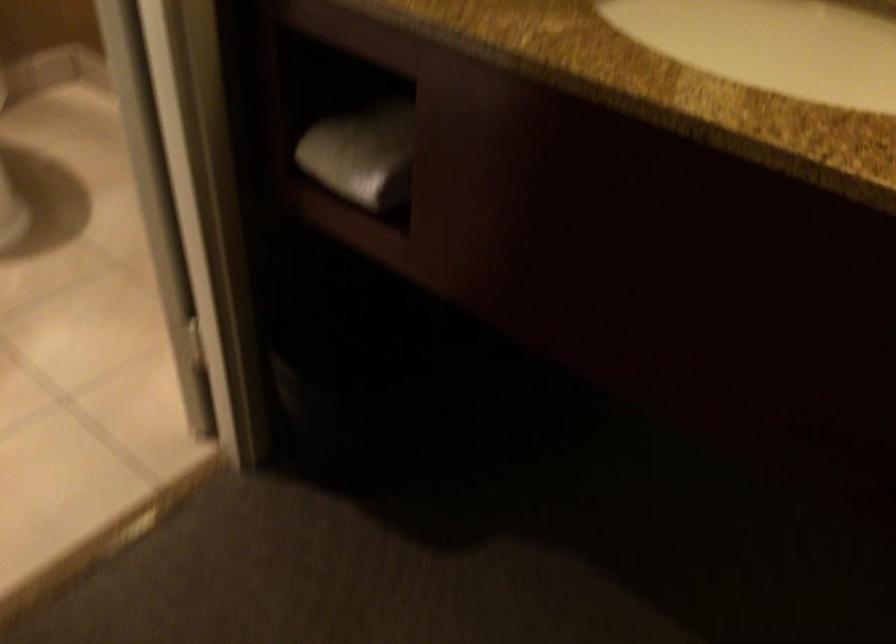
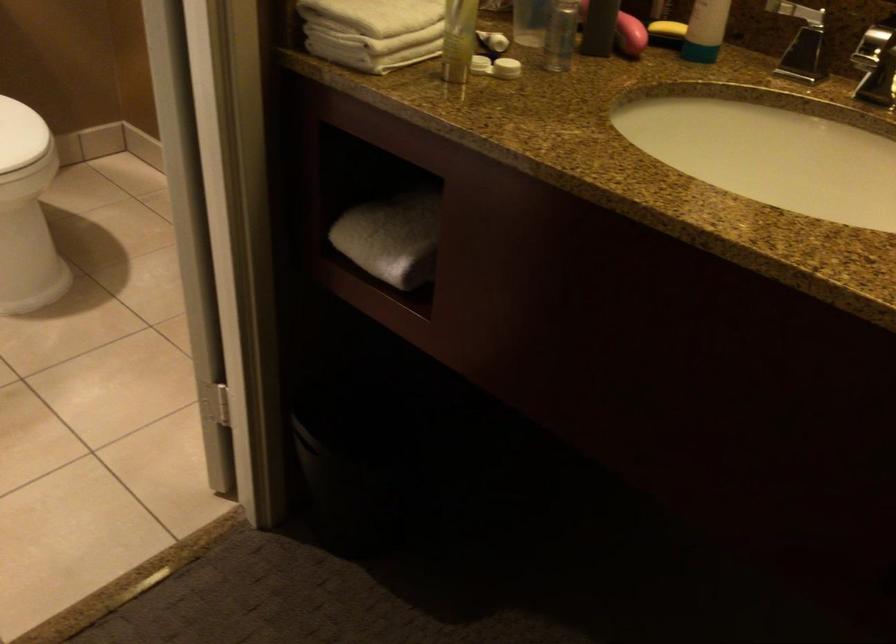
Question: Based on the continuous images, in which direction is the camera rotating? Reply with the corresponding letter.

Choices:
 (A) Left
 (B) Right
 (C) Up
 (D) Down

Answer: (C)